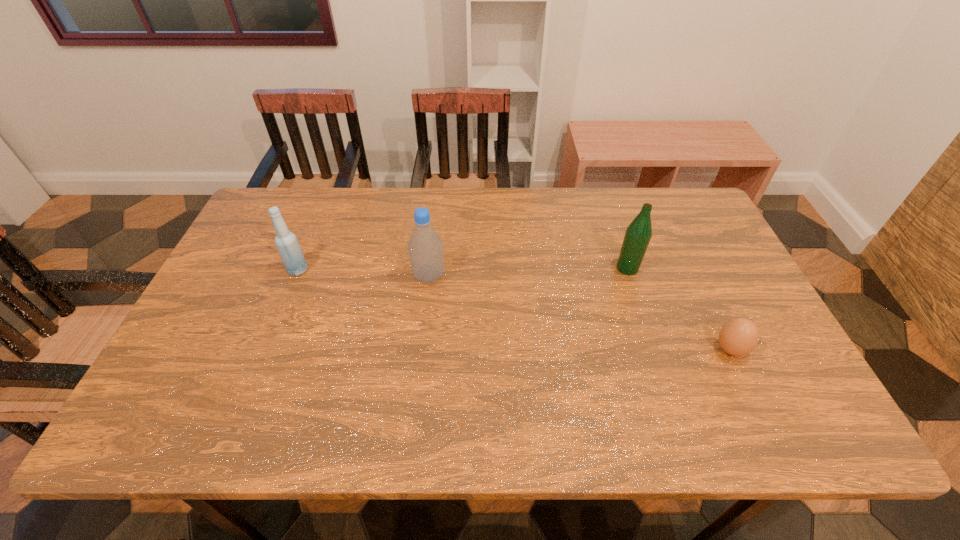
The height and width of the screenshot is (540, 960). In the image, there is a desktop. What are the coordinates of `vacant space at the far edge` in the screenshot? It's located at (515, 223).

Identify the location of free region at the near edge of the desktop. The image size is (960, 540). (347, 424).

Identify the location of vacant region at the right edge. (756, 348).

The height and width of the screenshot is (540, 960). Find the location of `free space at the far left corner of the desktop`. free space at the far left corner of the desktop is located at coordinates (305, 207).

Where is `vacant area at the far right corner`? vacant area at the far right corner is located at coordinates (675, 222).

Find the location of a particular element. free space that is in between the second object from left to right and the rightmost bottle is located at coordinates (528, 272).

Image resolution: width=960 pixels, height=540 pixels. What are the coordinates of `vacant space in between the leftmost bottle and the second bottle from right to left` in the screenshot? It's located at (364, 273).

Locate an element on the screen. blank region between the rightmost object and the leftmost bottle is located at coordinates (515, 310).

At what (x,y) coordinates should I click in order to perform the action: click on empty space that is in between the third object from right to left and the rightmost object. Please return your answer as a coordinate pair (x, y). This screenshot has height=540, width=960. Looking at the image, I should click on (580, 313).

This screenshot has width=960, height=540. Identify the location of free space between the nearest object and the second bottle from right to left. (580, 313).